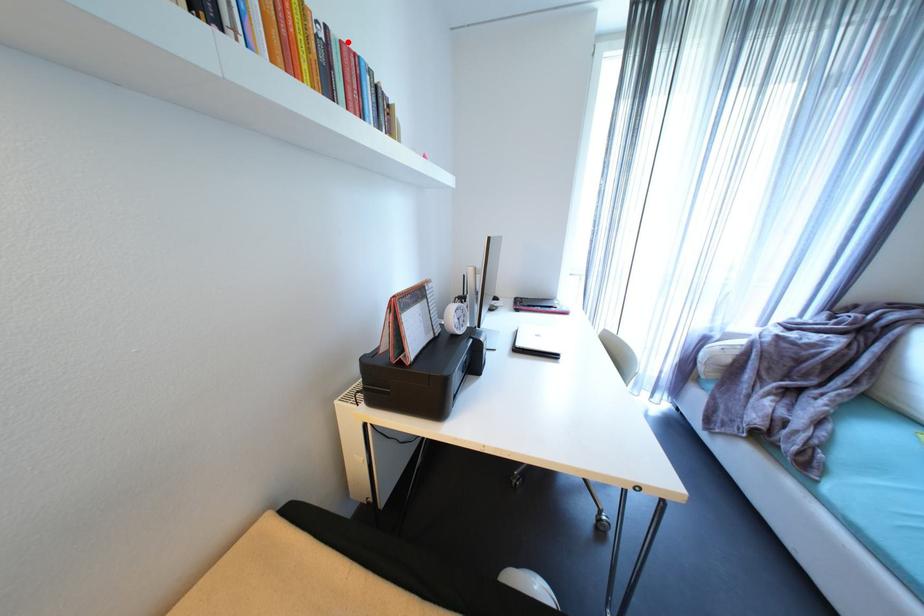
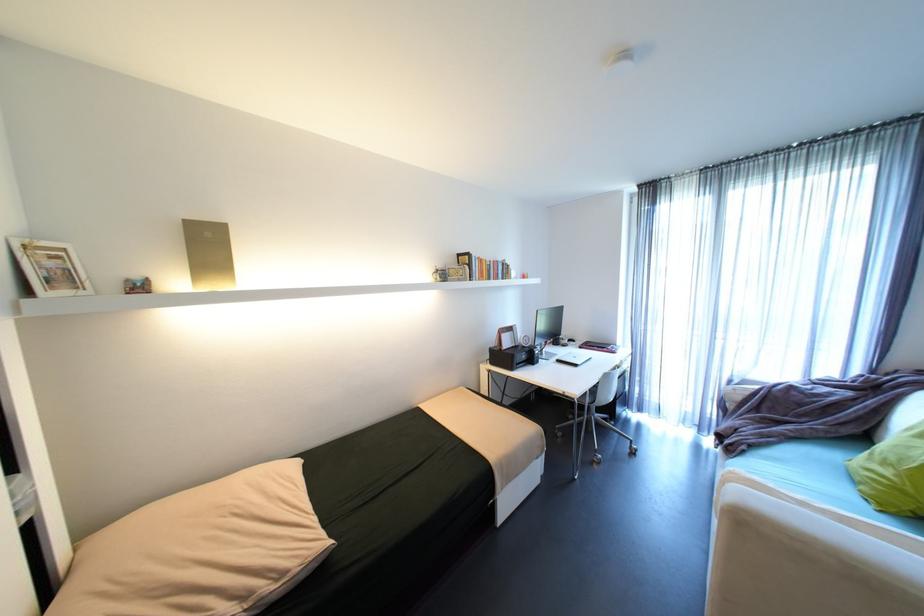
The point at the highlighted location is marked in the first image. Where is the corresponding point in the second image?

(500, 262)